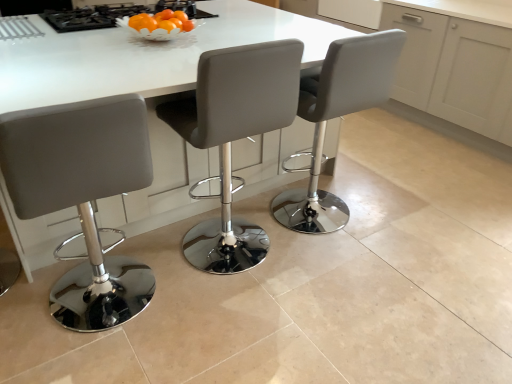
Question: Should I look upward or downward to see matte gray stool at center, the 2th chair when ordered from left to right?

Choices:
 (A) down
 (B) up

Answer: (B)

Question: Does white glossy table at center turn towards white leather stool at center, the first chair from the right?

Choices:
 (A) yes
 (B) no

Answer: (B)

Question: Are white glossy table at center and white leather stool at center, placed as the third chair when sorted from left to right, located far from each other?

Choices:
 (A) no
 (B) yes

Answer: (A)

Question: Is white glossy table at center outside of white leather stool at center, the first chair from the right?

Choices:
 (A) yes
 (B) no

Answer: (A)

Question: Can you confirm if white glossy table at center is taller than white leather stool at center, placed as the third chair when sorted from left to right?

Choices:
 (A) no
 (B) yes

Answer: (A)

Question: From the image's perspective, is white glossy table at center located beneath white leather stool at center, placed as the third chair when sorted from left to right?

Choices:
 (A) yes
 (B) no

Answer: (B)

Question: Is white glossy table at center smaller than white leather stool at center, the first chair from the right?

Choices:
 (A) yes
 (B) no

Answer: (B)

Question: Is the depth of white leather stool at center, placed as the third chair when sorted from left to right, greater than that of matte gray stool at center, the 2th chair when ordered from right to left?

Choices:
 (A) yes
 (B) no

Answer: (A)

Question: Is white leather stool at center, the first chair from the right, smaller than matte gray stool at center, the 2th chair when ordered from left to right?

Choices:
 (A) no
 (B) yes

Answer: (B)

Question: Is white leather stool at center, the first chair from the right, not within matte gray stool at center, the 2th chair when ordered from right to left?

Choices:
 (A) yes
 (B) no

Answer: (A)

Question: Does white leather stool at center, the first chair from the right, have a lesser width compared to matte gray stool at center, the 2th chair when ordered from left to right?

Choices:
 (A) no
 (B) yes

Answer: (A)

Question: Is white leather stool at center, placed as the third chair when sorted from left to right, surrounding matte gray stool at center, the 2th chair when ordered from left to right?

Choices:
 (A) yes
 (B) no

Answer: (B)

Question: Can you confirm if white leather stool at center, placed as the third chair when sorted from left to right, is taller than matte gray stool at center, the 2th chair when ordered from right to left?

Choices:
 (A) no
 (B) yes

Answer: (A)

Question: From a real-world perspective, does matte gray stool at center, the 2th chair when ordered from left to right, stand above black glass gas stove at upper center?

Choices:
 (A) yes
 (B) no

Answer: (B)